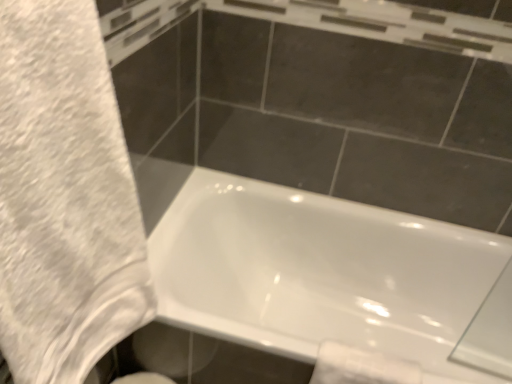
At what (x,y) coordinates should I click in order to perform the action: click on white glossy bathtub at lower center. Please return your answer as a coordinate pair (x, y). Looking at the image, I should click on (319, 273).

What do you see at coordinates (361, 367) in the screenshot? I see `white glossy toilet paper at lower right` at bounding box center [361, 367].

Image resolution: width=512 pixels, height=384 pixels. Describe the element at coordinates (64, 198) in the screenshot. I see `white fluffy towel at left` at that location.

Locate an element on the screen. white glossy bathtub at lower center is located at coordinates (319, 273).

Considering the relative positions of white fluffy towel at left and white glossy bathtub at lower center in the image provided, is white fluffy towel at left behind white glossy bathtub at lower center?

No, white fluffy towel at left is in front of white glossy bathtub at lower center.

Does white fluffy towel at left appear on the left side of white glossy bathtub at lower center?

Correct, you'll find white fluffy towel at left to the left of white glossy bathtub at lower center.

In terms of width, does white fluffy towel at left look wider or thinner when compared to white glossy bathtub at lower center?

In the image, white fluffy towel at left appears to be more narrow than white glossy bathtub at lower center.

Is white glossy bathtub at lower center not inside white fluffy towel at left?

Yes.

The height and width of the screenshot is (384, 512). Identify the location of bathtub on the right of white fluffy towel at left. (319, 273).

Is point (207, 333) positioned after point (34, 268)?

That is True.

From the picture: From the image's perspective, which one is positioned higher, white glossy bathtub at lower center or white fluffy towel at left?

From the image's view, white fluffy towel at left is above.

Which of these two, white glossy toilet paper at lower right or white glossy bathtub at lower center, is smaller?

white glossy toilet paper at lower right.

From the image's perspective, which is above, white glossy toilet paper at lower right or white glossy bathtub at lower center?

white glossy bathtub at lower center is shown above in the image.

How many degrees apart are the facing directions of white glossy toilet paper at lower right and white glossy bathtub at lower center?

They differ by 0.504 degrees in their facing directions.

Is point (376, 379) farther from viewer compared to point (267, 334)?

No, (376, 379) is in front of (267, 334).

Who is smaller, white glossy toilet paper at lower right or white fluffy towel at left?

Smaller between the two is white glossy toilet paper at lower right.

Locate an element on the screen. This screenshot has width=512, height=384. bath towel in front of the white glossy toilet paper at lower right is located at coordinates (64, 198).

Between white glossy toilet paper at lower right and white fluffy towel at left, which one appears on the right side from the viewer's perspective?

Positioned to the right is white glossy toilet paper at lower right.

Which is behind, point (379, 366) or point (82, 174)?

The point (379, 366) is farther.

Considering the sizes of objects white fluffy towel at left and white glossy toilet paper at lower right in the image provided, who is taller, white fluffy towel at left or white glossy toilet paper at lower right?

white fluffy towel at left.

Which of these two, white fluffy towel at left or white glossy toilet paper at lower right, is thinner?

With smaller width is white glossy toilet paper at lower right.

How many degrees apart are the facing directions of white fluffy towel at left and white glossy toilet paper at lower right?

The angle between the facing direction of white fluffy towel at left and the facing direction of white glossy toilet paper at lower right is 89.2 degrees.

Is white fluffy towel at left further to the viewer compared to white glossy toilet paper at lower right?

No, white fluffy towel at left is closer to the viewer.

Which object is wider, white glossy bathtub at lower center or white glossy toilet paper at lower right?

white glossy bathtub at lower center is wider.

How different are the orientations of white glossy bathtub at lower center and white glossy toilet paper at lower right in degrees?

white glossy bathtub at lower center and white glossy toilet paper at lower right are facing 0.504 degrees away from each other.

Considering the positions of objects white glossy bathtub at lower center and white glossy toilet paper at lower right in the image provided, who is more to the right, white glossy bathtub at lower center or white glossy toilet paper at lower right?

white glossy bathtub at lower center is more to the right.

Is white glossy bathtub at lower center aimed at white glossy toilet paper at lower right?

Yes, white glossy bathtub at lower center is aimed at white glossy toilet paper at lower right.

Locate an element on the screen. The width and height of the screenshot is (512, 384). bathtub that appears below the white fluffy towel at left (from the image's perspective) is located at coordinates (319, 273).

Where is `bathtub behind the white fluffy towel at left`? Image resolution: width=512 pixels, height=384 pixels. bathtub behind the white fluffy towel at left is located at coordinates (319, 273).

When comparing their distances from white glossy toilet paper at lower right, does white glossy bathtub at lower center or white fluffy towel at left seem closer?

white glossy bathtub at lower center.

Looking at the image, which one is located further to white glossy bathtub at lower center, white fluffy towel at left or white glossy toilet paper at lower right?

white fluffy towel at left.

When comparing their distances from white fluffy towel at left, does white glossy bathtub at lower center or white glossy toilet paper at lower right seem further?

Based on the image, white glossy bathtub at lower center appears to be further to white fluffy towel at left.

Looking at the image, which one is located further to white glossy bathtub at lower center, white glossy toilet paper at lower right or white fluffy towel at left?

white fluffy towel at left is positioned further to the anchor white glossy bathtub at lower center.

Which object lies further to the anchor point white glossy toilet paper at lower right, white fluffy towel at left or white glossy bathtub at lower center?

white fluffy towel at left lies further to white glossy toilet paper at lower right than the other object.

When comparing their distances from white fluffy towel at left, does white glossy toilet paper at lower right or white glossy bathtub at lower center seem further?

The object further to white fluffy towel at left is white glossy bathtub at lower center.

Where is `bathtub between white fluffy towel at left and white glossy toilet paper at lower right in the front-back direction`? The image size is (512, 384). bathtub between white fluffy towel at left and white glossy toilet paper at lower right in the front-back direction is located at coordinates (319, 273).